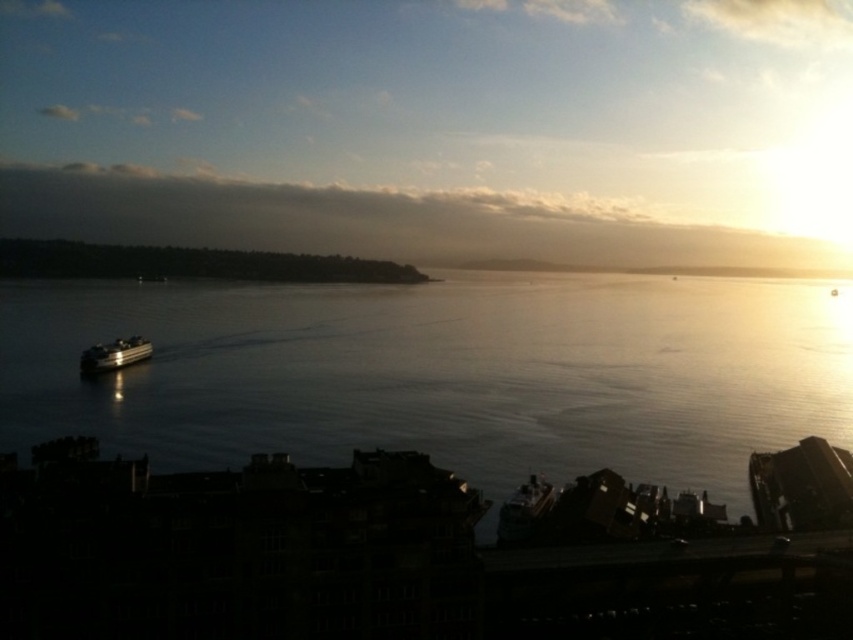
Which is below, clear water at center or shiny silver ferry at lower left?

shiny silver ferry at lower left is lower down.

Who is more distant from viewer, [3,392] or [126,348]?

The point [126,348] is behind.

Is point (614, 417) more distant than point (119, 365)?

No, it is in front of (119, 365).

You are a GUI agent. You are given a task and a screenshot of the screen. Output one action in this format:
    pyautogui.click(x=<x>, y=<y>)
    Task: Click on the clear water at center
    The image size is (853, 640).
    Given the screenshot: What is the action you would take?
    pyautogui.click(x=444, y=372)